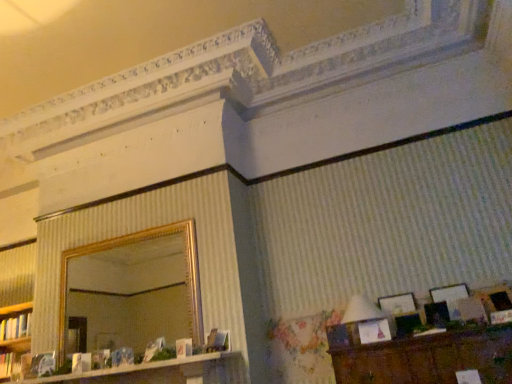
Question: Is matte silver picture frame at upper right, which appears as the 1th picture frame when viewed from the left, at the back of white fabric lampshade at right?

Choices:
 (A) no
 (B) yes

Answer: (A)

Question: From a real-world perspective, is white fabric lampshade at right beneath matte silver picture frame at upper right, which appears as the 1th picture frame when viewed from the left?

Choices:
 (A) no
 (B) yes

Answer: (B)

Question: Does white fabric lampshade at right have a larger size compared to matte silver picture frame at upper right, which appears as the 1th picture frame when viewed from the left?

Choices:
 (A) no
 (B) yes

Answer: (B)

Question: Can matte silver picture frame at upper right, which appears as the 1th picture frame when viewed from the left, be found inside white fabric lampshade at right?

Choices:
 (A) yes
 (B) no

Answer: (B)

Question: Does white fabric lampshade at right turn towards matte silver picture frame at upper right, acting as the third picture frame starting from the right?

Choices:
 (A) no
 (B) yes

Answer: (A)

Question: Is wooden picture frame at lower right, positioned as the first picture frame in right-to-left order, wider or thinner than matte black picture frame at lower right, arranged as the 2th picture frame when viewed from the left?

Choices:
 (A) thin
 (B) wide

Answer: (B)

Question: Relative to matte black picture frame at lower right, arranged as the 2th picture frame when viewed from the right, is wooden picture frame at lower right, arranged as the 3th picture frame when viewed from the left, in front or behind?

Choices:
 (A) front
 (B) behind

Answer: (A)

Question: From a real-world perspective, is wooden picture frame at lower right, positioned as the first picture frame in right-to-left order, above or below matte black picture frame at lower right, arranged as the 2th picture frame when viewed from the right?

Choices:
 (A) above
 (B) below

Answer: (B)

Question: Is wooden picture frame at lower right, arranged as the 3th picture frame when viewed from the left, to the left or to the right of matte black picture frame at lower right, arranged as the 2th picture frame when viewed from the left, in the image?

Choices:
 (A) left
 (B) right

Answer: (B)

Question: Do you think white glossy dresser at lower left is within white fabric lampshade at right, or outside of it?

Choices:
 (A) outside
 (B) inside

Answer: (A)

Question: In terms of width, does white glossy dresser at lower left look wider or thinner when compared to white fabric lampshade at right?

Choices:
 (A) thin
 (B) wide

Answer: (B)

Question: In terms of size, does white glossy dresser at lower left appear bigger or smaller than white fabric lampshade at right?

Choices:
 (A) big
 (B) small

Answer: (A)

Question: From a real-world perspective, is white glossy dresser at lower left positioned above or below white fabric lampshade at right?

Choices:
 (A) above
 (B) below

Answer: (B)

Question: In terms of size, does matte white book at lower left, which appears as the 1th book when ordered from the bottom, appear bigger or smaller than gold-framed mirror at upper center?

Choices:
 (A) small
 (B) big

Answer: (A)

Question: In terms of height, does matte white book at lower left, the 2th book from the top, look taller or shorter compared to gold-framed mirror at upper center?

Choices:
 (A) tall
 (B) short

Answer: (B)